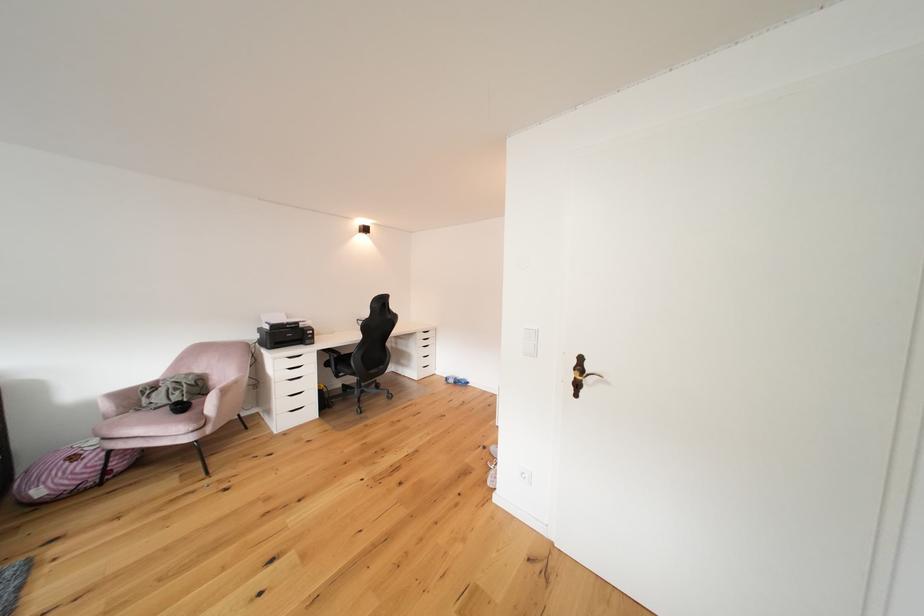
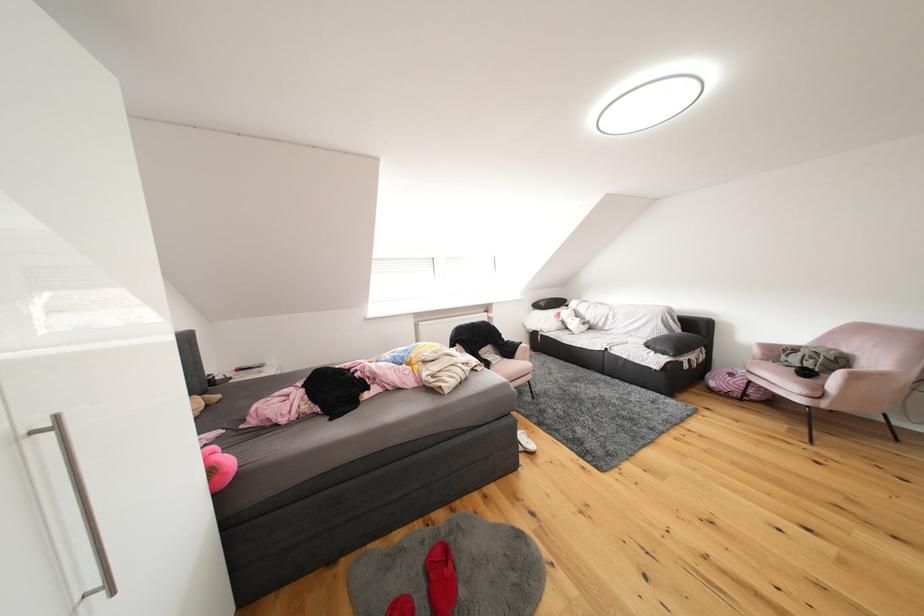
In the second image, find the point that corresponds to the point at 83,462 in the first image.

(740, 379)